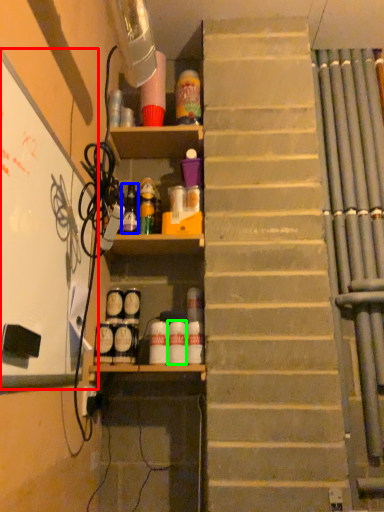
Question: Based on their relative distances, which object is nearer to bulletin board (highlighted by a red box)? Choose from bottle (highlighted by a blue box) and bottle (highlighted by a green box).

Choices:
 (A) bottle
 (B) bottle

Answer: (A)